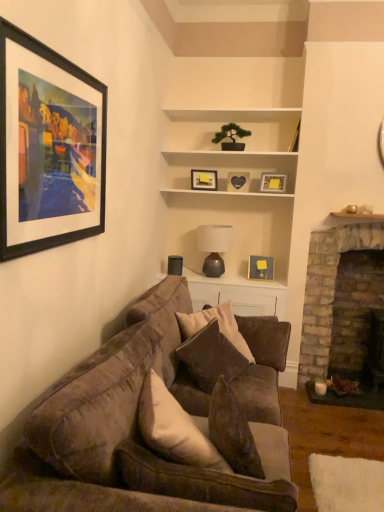
Question: In terms of width, does matte gray lamp at center look wider or thinner when compared to wooden heart at center, acting as the 3th picture frame starting from the right?

Choices:
 (A) wide
 (B) thin

Answer: (A)

Question: From the image's perspective, is matte gray lamp at center above or below wooden heart at center, marked as the 3th picture frame in a left-to-right arrangement?

Choices:
 (A) below
 (B) above

Answer: (A)

Question: Estimate the real-world distances between objects in this image. Which object is farther from the velvet brown pillow at center?

Choices:
 (A) velvet brown couch at lower left, which appears as the first studio couch when viewed from the front
 (B) white matte cabinet at center
 (C) wooden heart at center, the 3th picture frame positioned from the front
 (D) matte black picture frame at center, which is the fourth picture frame in front-to-back order
 (E) matte gold picture frame at center, marked as the 2th picture frame in a right-to-left arrangement

Answer: (B)

Question: Considering the real-world distances, which object is closest to the matte black picture frame at upper left, positioned as the fifth picture frame in right-to-left order?

Choices:
 (A) velvet brown couch at center, the 1th studio couch when ordered from back to front
 (B) matte gold picture frame at upper center, positioned as the second picture frame in front-to-back order
 (C) matte gray lamp at center
 (D) velvet brown pillow at center
 (E) brick fireplace at right

Answer: (A)